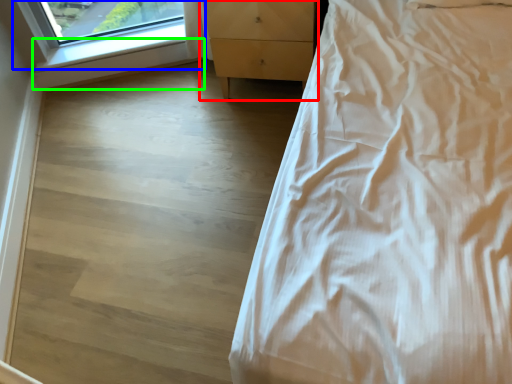
Question: Estimate the real-world distances between objects in this image. Which object is closer to chest of drawers (highlighted by a red box), window (highlighted by a blue box) or window sill (highlighted by a green box)?

Choices:
 (A) window
 (B) window sill

Answer: (A)